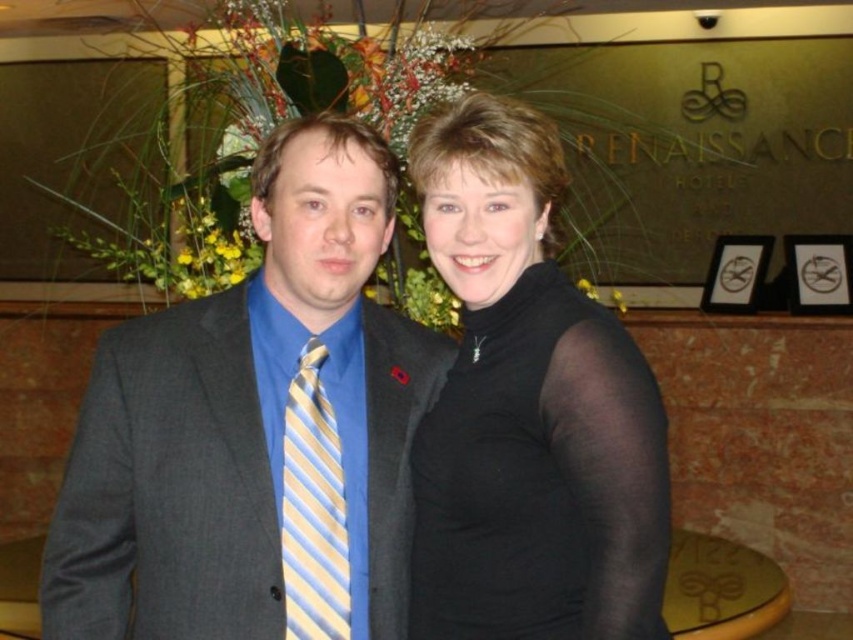
Can you confirm if black matte turtleneck at center is wider than yellow and blue striped tie at left?

Yes, black matte turtleneck at center is wider than yellow and blue striped tie at left.

Is black matte turtleneck at center further to camera compared to yellow and blue striped tie at left?

That is False.

Does point (641, 541) come closer to viewer compared to point (334, 504)?

Yes.

Locate an element on the screen. This screenshot has width=853, height=640. black matte turtleneck at center is located at coordinates (527, 412).

What do you see at coordinates (254, 428) in the screenshot? I see `matte gray suit at center` at bounding box center [254, 428].

Which is behind, point (335, 196) or point (293, 394)?

Positioned behind is point (293, 394).

You are a GUI agent. You are given a task and a screenshot of the screen. Output one action in this format:
    pyautogui.click(x=<x>, y=<y>)
    Task: Click on the matte gray suit at center
    This screenshot has height=640, width=853.
    Given the screenshot: What is the action you would take?
    pyautogui.click(x=254, y=428)

Consider the image. Is matte gray suit at center shorter than black matte turtleneck at center?

Correct, matte gray suit at center is not as tall as black matte turtleneck at center.

Between matte gray suit at center and black matte turtleneck at center, which one appears on the left side from the viewer's perspective?

From the viewer's perspective, matte gray suit at center appears more on the left side.

Does point (135, 628) lie behind point (621, 586)?

Yes, point (135, 628) is farther from viewer.

At what (x,y) coordinates should I click in order to perform the action: click on matte gray suit at center. Please return your answer as a coordinate pair (x, y). This screenshot has height=640, width=853. Looking at the image, I should click on (254, 428).